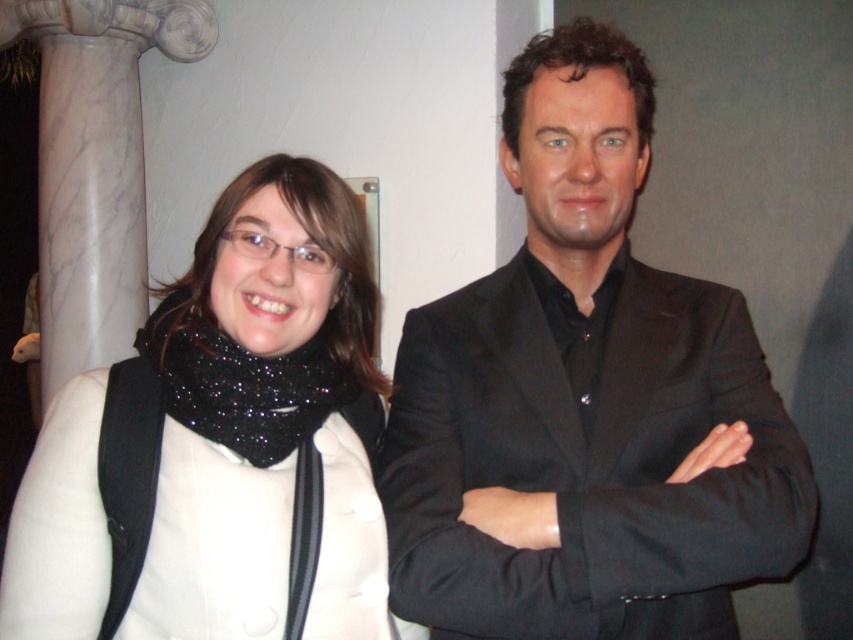
Does point (659, 484) come farther from viewer compared to point (62, 582)?

Yes, point (659, 484) is farther from viewer.

Who is shorter, black matte suit at center or white matte scarf at left?

With less height is white matte scarf at left.

Who is more distant from viewer, (761, 518) or (236, 340)?

Positioned behind is point (236, 340).

Image resolution: width=853 pixels, height=640 pixels. In order to click on black matte suit at center in this screenshot , I will do `click(585, 401)`.